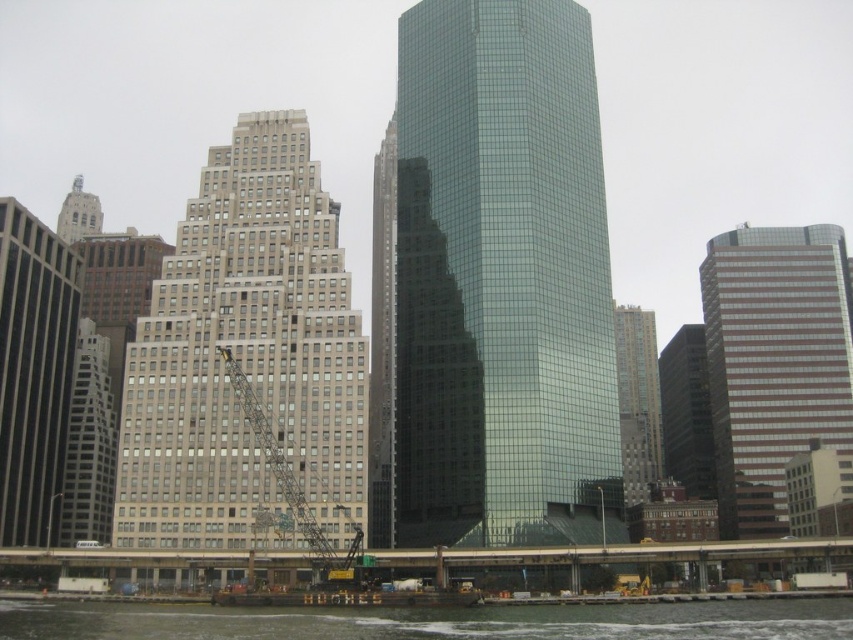
You are a city planner assessing the urban layout. Given the presence of the shiny glass skyscraper at center and the gray stone building at center, which one could potentially accommodate more office spaces based on their spatial dimensions?

The shiny glass skyscraper at center is wider than the gray stone building at center, so it could potentially accommodate more office spaces due to its larger floor area.

You are standing at the center of the urban scene and want to move towards the point with coordinates closest to you. Which point, point (407, 202) or point (64, 308), is closer to your current position?

Point (407, 202) is in front of point (64, 308), so it is closer to your current position.

You are standing at the center of the image and want to locate the shiny glass skyscraper at center. According to the coordinates provided, where exactly is it positioned?

The shiny glass skyscraper at center is positioned at coordinates point (498, 284).